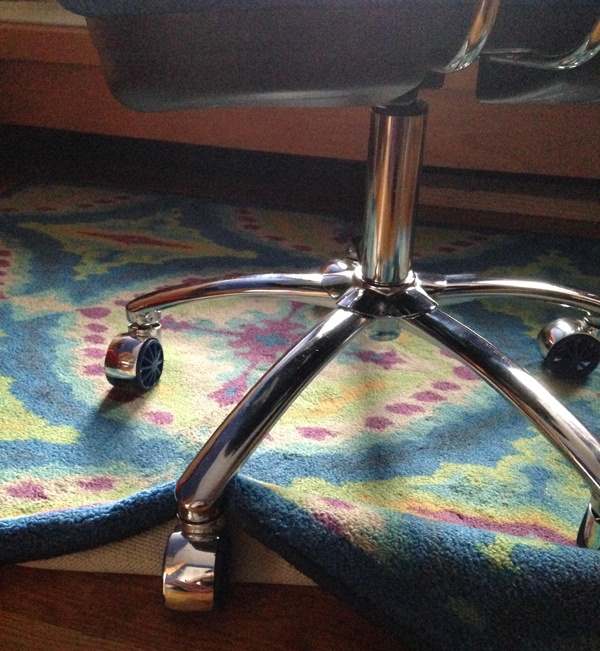
The width and height of the screenshot is (600, 651). I want to click on chair seat, so click(206, 81).